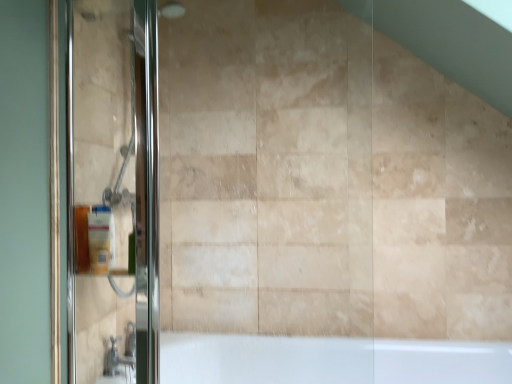
Question: From the image's perspective, is matte plastic soap dispenser at left on matte silver faucet at lower left?

Choices:
 (A) no
 (B) yes

Answer: (B)

Question: From a real-world perspective, does matte plastic soap dispenser at left sit lower than matte silver faucet at lower left?

Choices:
 (A) no
 (B) yes

Answer: (A)

Question: Can matte silver faucet at lower left be found inside matte plastic soap dispenser at left?

Choices:
 (A) yes
 (B) no

Answer: (B)

Question: Is matte plastic soap dispenser at left positioned before matte silver faucet at lower left?

Choices:
 (A) no
 (B) yes

Answer: (B)

Question: Is matte plastic soap dispenser at left thinner than matte silver faucet at lower left?

Choices:
 (A) no
 (B) yes

Answer: (B)

Question: Can you confirm if matte plastic soap dispenser at left is shorter than matte silver faucet at lower left?

Choices:
 (A) yes
 (B) no

Answer: (B)

Question: Considering the relative sizes of matte plastic soap dispenser at left and polished glass shower door at left in the image provided, is matte plastic soap dispenser at left bigger than polished glass shower door at left?

Choices:
 (A) no
 (B) yes

Answer: (A)

Question: Can you confirm if matte plastic soap dispenser at left is shorter than polished glass shower door at left?

Choices:
 (A) no
 (B) yes

Answer: (B)

Question: Are matte plastic soap dispenser at left and polished glass shower door at left far apart?

Choices:
 (A) yes
 (B) no

Answer: (B)

Question: Is matte plastic soap dispenser at left to the right of polished glass shower door at left from the viewer's perspective?

Choices:
 (A) no
 (B) yes

Answer: (A)

Question: Is matte plastic soap dispenser at left taller than polished glass shower door at left?

Choices:
 (A) no
 (B) yes

Answer: (A)

Question: Does matte plastic soap dispenser at left have a smaller size compared to polished glass shower door at left?

Choices:
 (A) yes
 (B) no

Answer: (A)

Question: Considering the relative sizes of matte silver faucet at lower left and matte plastic soap dispenser at left in the image provided, is matte silver faucet at lower left bigger than matte plastic soap dispenser at left?

Choices:
 (A) yes
 (B) no

Answer: (A)